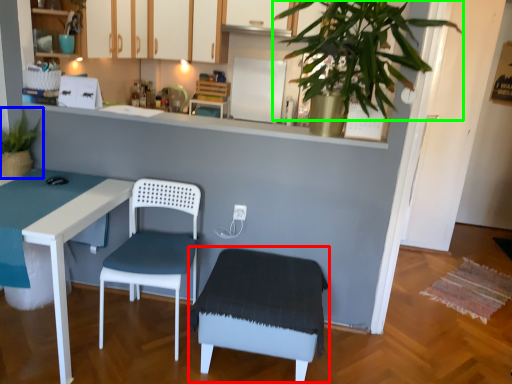
Question: Which is farther away from step stool (highlighted by a red box)? houseplant (highlighted by a blue box) or vegetation (highlighted by a green box)?

Choices:
 (A) houseplant
 (B) vegetation

Answer: (A)